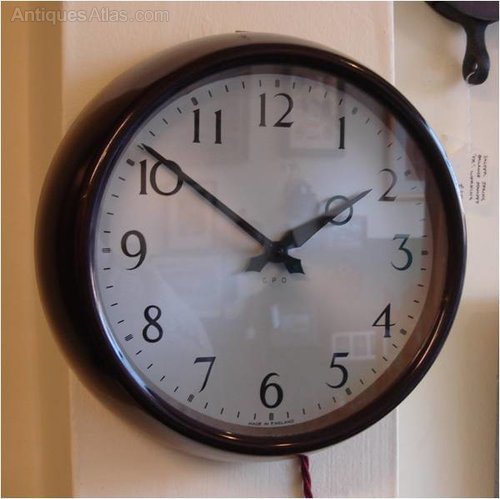
What are the coordinates of `red spiraled clock cord` in the screenshot? It's located at (309, 482).